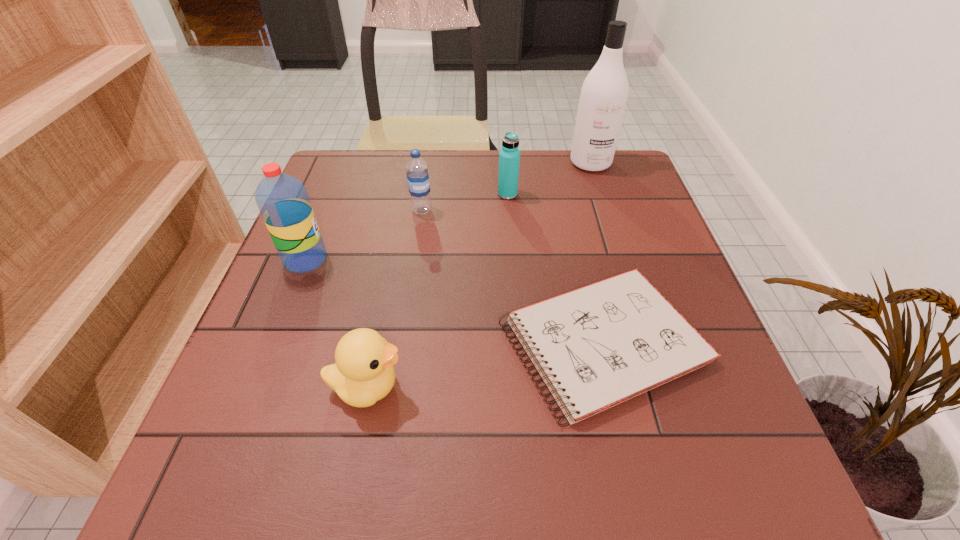
What are the coordinates of `notepad at the right edge` in the screenshot? It's located at (595, 347).

Find the location of a particular element. Image resolution: width=960 pixels, height=540 pixels. object that is at the far right corner is located at coordinates (603, 98).

Locate an element on the screen. The height and width of the screenshot is (540, 960). free space at the far edge of the desktop is located at coordinates (381, 184).

In order to click on vacant space at the near edge of the desktop in this screenshot , I will do `click(563, 487)`.

At what (x,y) coordinates should I click in order to perform the action: click on vacant point at the left edge. Please return your answer as a coordinate pair (x, y). The height and width of the screenshot is (540, 960). Looking at the image, I should click on (336, 228).

The height and width of the screenshot is (540, 960). In order to click on vacant space at the right edge in this screenshot , I will do `click(719, 414)`.

Identify the location of vacant space at the far right corner. The image size is (960, 540). pyautogui.click(x=627, y=162).

What are the coordinates of `free space that is in between the farthest object and the duck` in the screenshot? It's located at (479, 275).

Locate an element on the screen. vacant region between the farthest water bottle and the second water bottle from right to left is located at coordinates (465, 202).

The image size is (960, 540). What are the coordinates of `unoccupied area between the farthest object and the duck` in the screenshot? It's located at (479, 275).